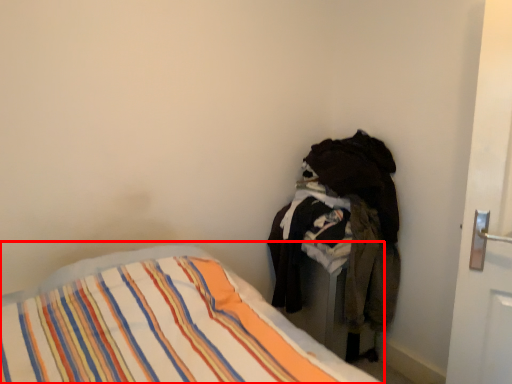
Question: From the image's perspective, where is bed (annotated by the red box) located in relation to laundry in the image?

Choices:
 (A) above
 (B) below

Answer: (B)